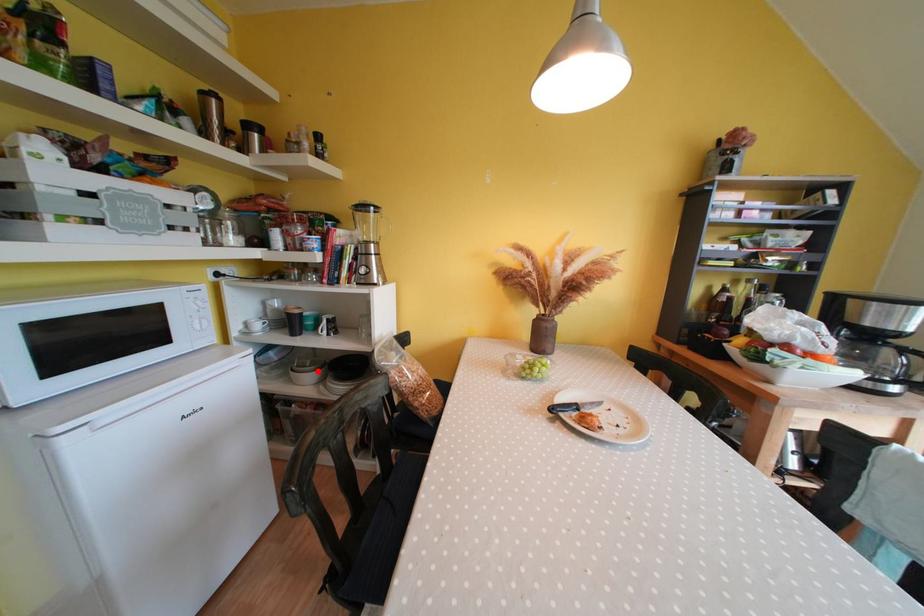
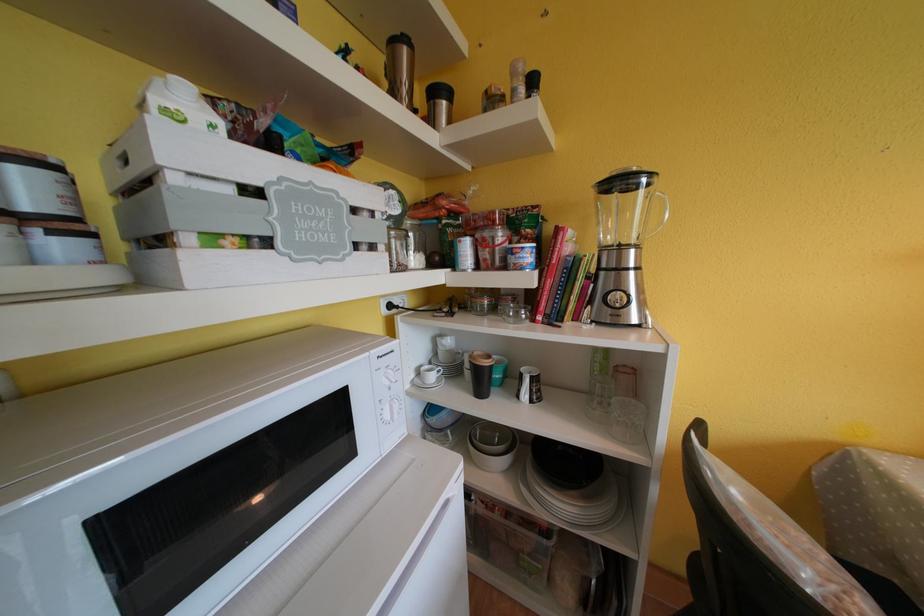
Where in the second image is the point corresponding to the highlighted location from the first image?

(507, 452)